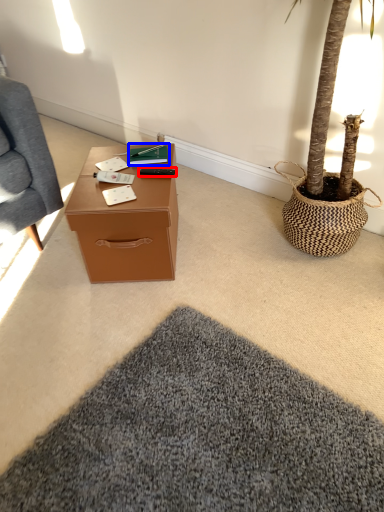
Question: Which of the following is the farthest to the observer, remote control (highlighted by a red box) or book (highlighted by a blue box)?

Choices:
 (A) remote control
 (B) book

Answer: (B)